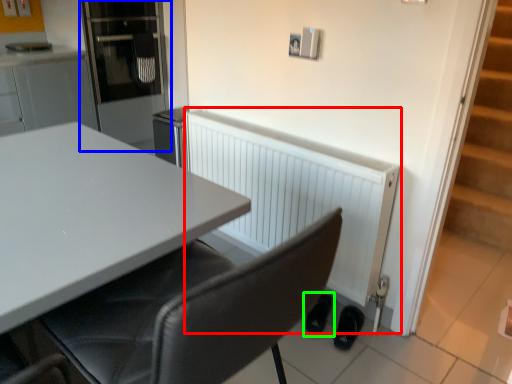
Question: Which is farther away from radiator (highlighted by a red box)? appliance (highlighted by a blue box) or footwear (highlighted by a green box)?

Choices:
 (A) appliance
 (B) footwear

Answer: (A)